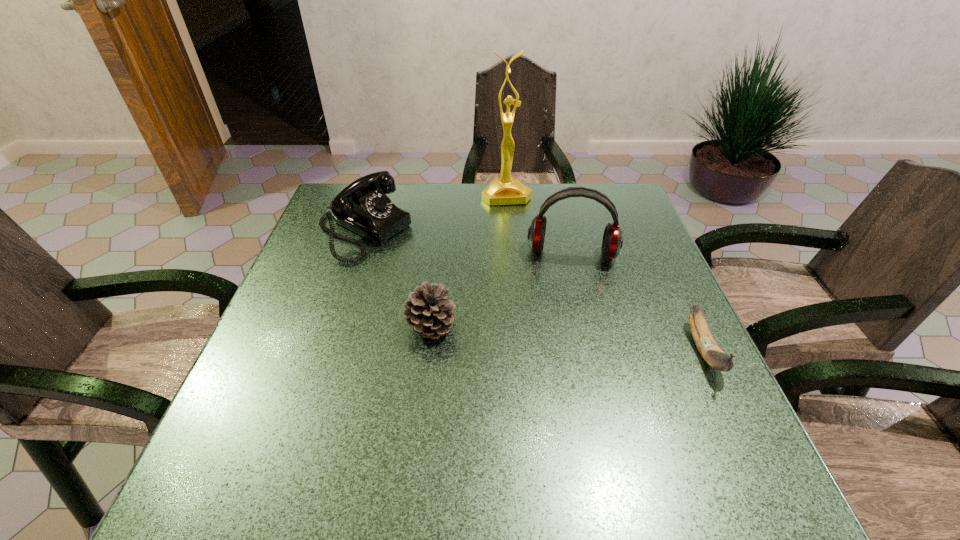
Find the location of a particular element. This screenshot has height=540, width=960. the fourth object from right to left is located at coordinates (427, 313).

At what (x,y) coordinates should I click in order to perform the action: click on the second shortest object. Please return your answer as a coordinate pair (x, y). Looking at the image, I should click on (427, 313).

Where is `the shortest object`? The image size is (960, 540). the shortest object is located at coordinates (711, 352).

The image size is (960, 540). In order to click on banana in this screenshot , I will do `click(711, 352)`.

Locate an element on the screen. This screenshot has width=960, height=540. earphone is located at coordinates (612, 242).

This screenshot has width=960, height=540. What are the coordinates of `the tallest object` in the screenshot? It's located at (505, 190).

Identify the location of telephone. The height and width of the screenshot is (540, 960). (363, 206).

The image size is (960, 540). Find the location of `the leftmost object`. the leftmost object is located at coordinates (363, 206).

Find the location of a particular element. The image size is (960, 540). vacant space located on the front of the second shortest object is located at coordinates (420, 426).

This screenshot has height=540, width=960. Find the location of `vacant point located at the stem of the rightmost object`. vacant point located at the stem of the rightmost object is located at coordinates (736, 420).